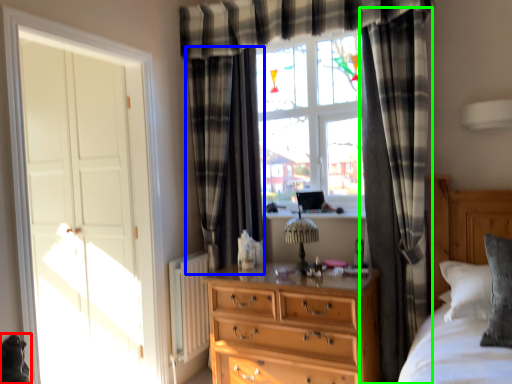
Question: Which object is positioned closest to animal (highlighted by a red box)? Select from curtain (highlighted by a blue box) and curtain (highlighted by a green box).

Choices:
 (A) curtain
 (B) curtain

Answer: (A)